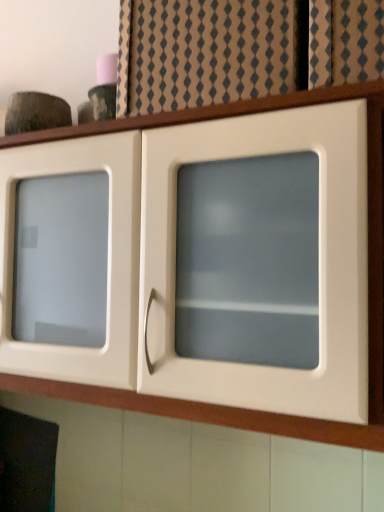
Question: From the image's perspective, is beige textured fabric at upper center on top of white glossy cabinet at upper center?

Choices:
 (A) yes
 (B) no

Answer: (A)

Question: Is beige textured fabric at upper center oriented towards white glossy cabinet at upper center?

Choices:
 (A) no
 (B) yes

Answer: (A)

Question: Is beige textured fabric at upper center turned away from white glossy cabinet at upper center?

Choices:
 (A) no
 (B) yes

Answer: (A)

Question: Is beige textured fabric at upper center far away from white glossy cabinet at upper center?

Choices:
 (A) yes
 (B) no

Answer: (B)

Question: From a real-world perspective, is beige textured fabric at upper center on white glossy cabinet at upper center?

Choices:
 (A) no
 (B) yes

Answer: (B)

Question: Is beige textured fabric at upper center to the left of white glossy cabinet at upper center from the viewer's perspective?

Choices:
 (A) yes
 (B) no

Answer: (B)

Question: Can you confirm if white glossy cabinet at upper center is taller than beige textured fabric at upper center?

Choices:
 (A) yes
 (B) no

Answer: (A)

Question: Considering the relative positions of white glossy cabinet at upper center and beige textured fabric at upper center in the image provided, is white glossy cabinet at upper center behind beige textured fabric at upper center?

Choices:
 (A) no
 (B) yes

Answer: (A)

Question: Could beige textured fabric at upper center be considered to be inside white glossy cabinet at upper center?

Choices:
 (A) yes
 (B) no

Answer: (B)

Question: Considering the relative sizes of white glossy cabinet at upper center and beige textured fabric at upper center in the image provided, is white glossy cabinet at upper center smaller than beige textured fabric at upper center?

Choices:
 (A) yes
 (B) no

Answer: (B)

Question: Considering the relative sizes of white glossy cabinet at upper center and beige textured fabric at upper center in the image provided, is white glossy cabinet at upper center thinner than beige textured fabric at upper center?

Choices:
 (A) yes
 (B) no

Answer: (B)

Question: From the image's perspective, is white glossy cabinet at upper center on top of beige textured fabric at upper center?

Choices:
 (A) yes
 (B) no

Answer: (B)

Question: Considering the positions of white glossy cabinet at upper center and beige textured fabric at upper center in the image, is white glossy cabinet at upper center taller or shorter than beige textured fabric at upper center?

Choices:
 (A) short
 (B) tall

Answer: (B)